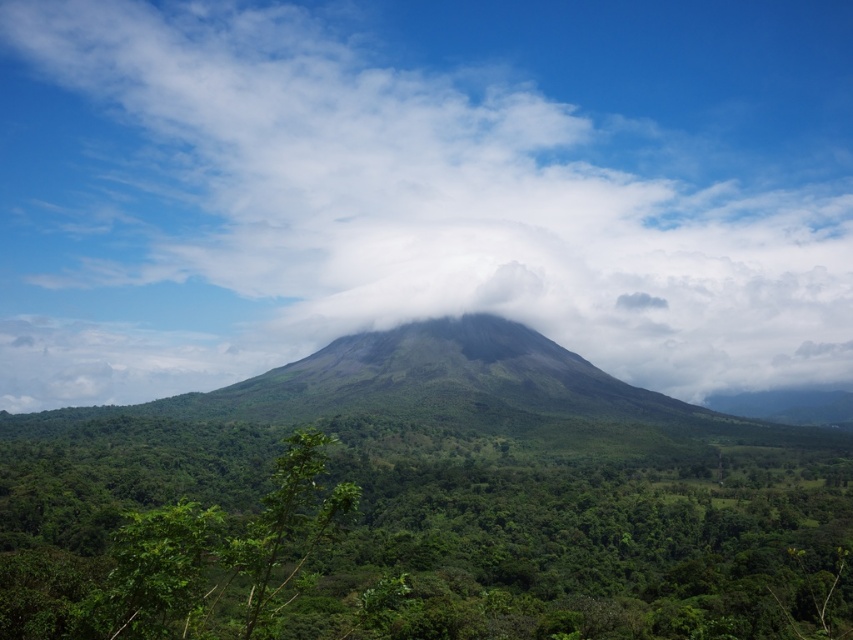
Based on the photo, you are standing at the base of Arenal Volcano and looking up at the scene. Which object is positioned to the left when comparing the white fluffy cloud at center and the green leafy forest at center?

The white fluffy cloud at center is positioned to the left of the green leafy forest at center.

You are a hiker standing at the base of Arenal Volcano. You see two points marked in the image. Which point is closer to you, the hiker, point at coordinate (170, 38) or point at coordinate (107, 476)?

Point at coordinate (170, 38) is closer to you because it is further to the viewer than point at coordinate (107, 476).